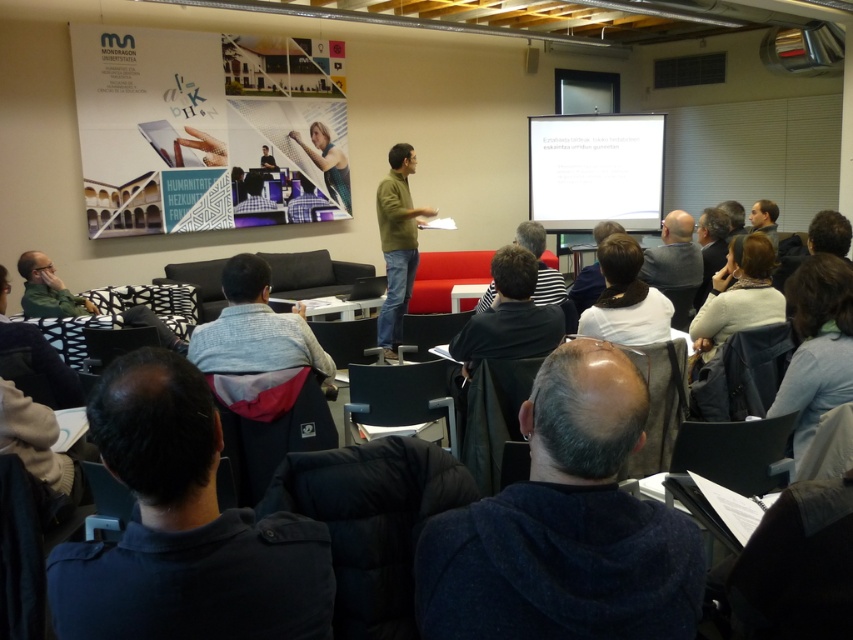
What do you see at coordinates (566, 525) in the screenshot? Image resolution: width=853 pixels, height=640 pixels. I see `dark blue hoodie at lower center` at bounding box center [566, 525].

Is dark blue hoodie at lower center above black hair at center?

Actually, dark blue hoodie at lower center is below black hair at center.

Which is in front, point (601, 438) or point (633, 321)?

Positioned in front is point (601, 438).

Locate an element on the screen. dark blue hoodie at lower center is located at coordinates (566, 525).

Who is more forward, (x=170, y=556) or (x=602, y=272)?

Point (x=170, y=556)

Does dark blue fabric at lower left have a lesser width compared to black hair at center?

Yes.

Who is more distant from viewer, [80,600] or [639,266]?

Positioned behind is point [639,266].

Locate an element on the screen. dark blue fabric at lower left is located at coordinates (183, 528).

Is light gray sweater at center below black hair at center?

Yes, light gray sweater at center is below black hair at center.

Looking at this image, does light gray sweater at center have a smaller size compared to black hair at center?

Incorrect, light gray sweater at center is not smaller in size than black hair at center.

The image size is (853, 640). What are the coordinates of `light gray sweater at center` in the screenshot? It's located at (256, 330).